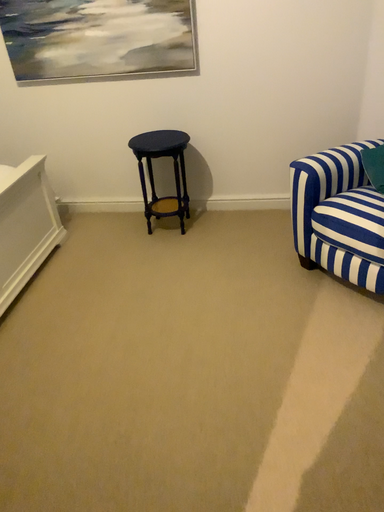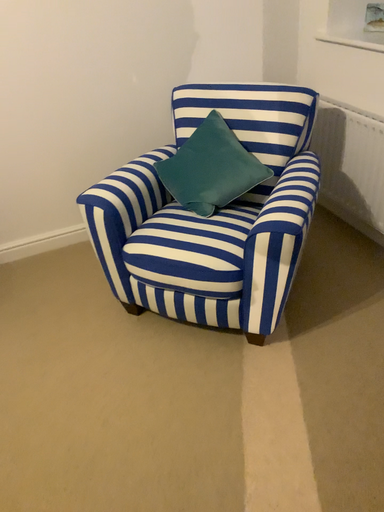
Question: How did the camera likely rotate when shooting the video?

Choices:
 (A) rotated left
 (B) rotated right

Answer: (B)